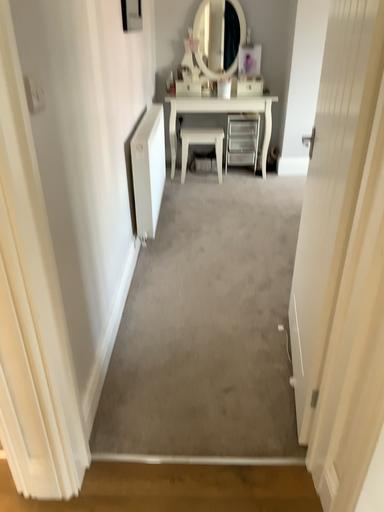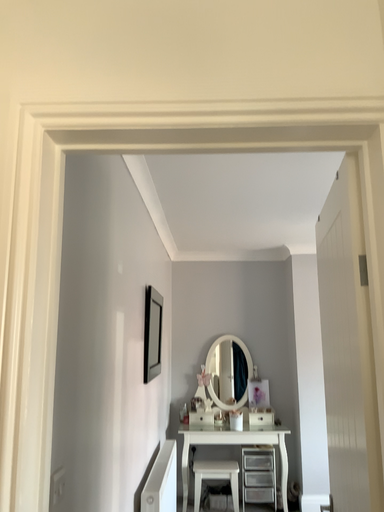
Question: Which way did the camera rotate in the video?

Choices:
 (A) rotated downward
 (B) rotated upward

Answer: (B)